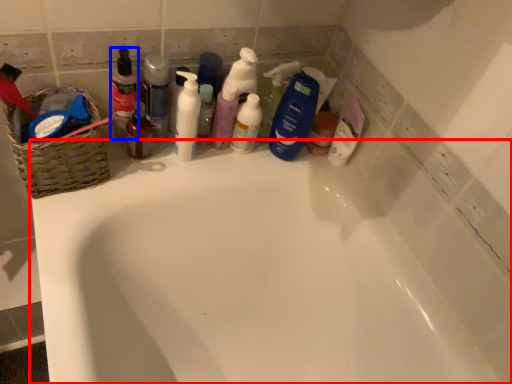
Question: Which point is further to the camera, bathtub (highlighted by a red box) or toiletry (highlighted by a blue box)?

Choices:
 (A) bathtub
 (B) toiletry

Answer: (B)